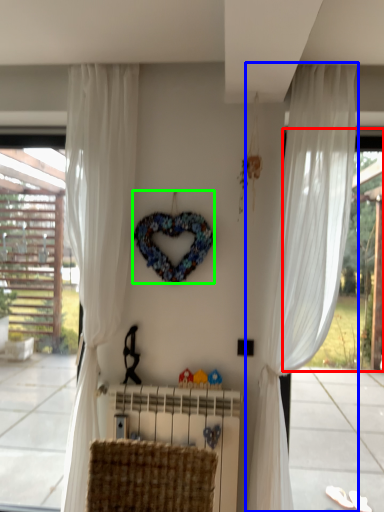
Question: Considering the real-world distances, which object is closest to window screen (highlighted by a red box)? curtain (highlighted by a blue box) or wreath (highlighted by a green box).

Choices:
 (A) curtain
 (B) wreath

Answer: (A)